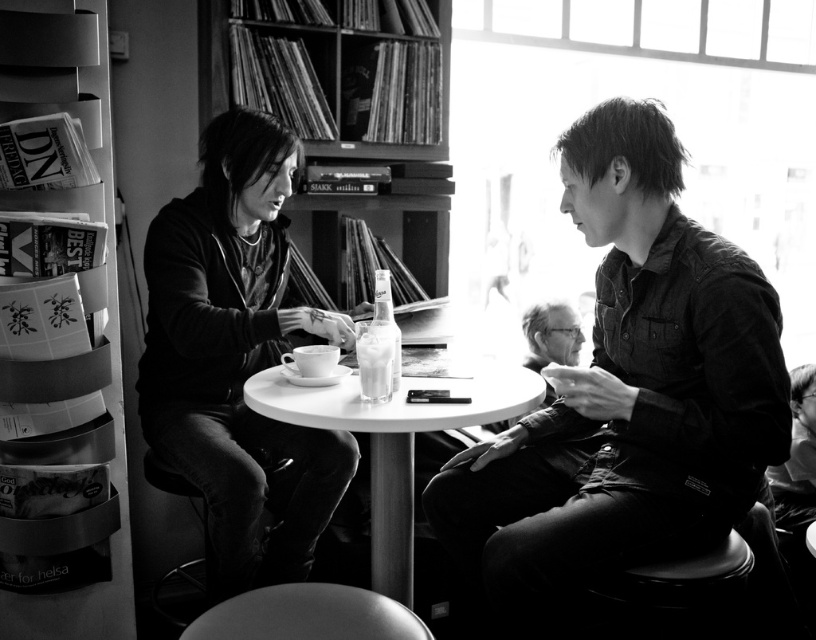
Question: Which is nearer to the matte black hoodie at left?

Choices:
 (A) denim jacket at right
 (B) white glossy round table at center
 (C) wooden bookshelf at upper center

Answer: (B)

Question: Considering the real-world distances, which object is closest to the denim jacket at right?

Choices:
 (A) matte black hoodie at left
 (B) white glossy round table at center
 (C) metallic gray bookshelf at left
 (D) wooden bookshelf at upper center

Answer: (B)

Question: Does white glossy round table at center have a larger size compared to metallic gray bookshelf at left?

Choices:
 (A) no
 (B) yes

Answer: (B)

Question: Is the position of denim jacket at right less distant than that of white glossy round table at center?

Choices:
 (A) no
 (B) yes

Answer: (B)

Question: From the image, what is the correct spatial relationship of matte black hoodie at left in relation to metallic gray bookshelf at left?

Choices:
 (A) left
 (B) right

Answer: (B)

Question: Among these objects, which one is farthest from the camera?

Choices:
 (A) denim jacket at right
 (B) matte black hoodie at left

Answer: (B)